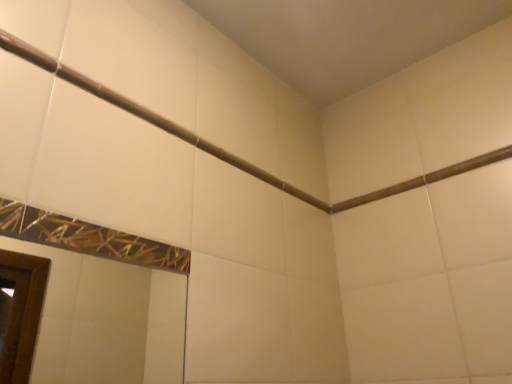
Question: Considering the relative positions of matte white shower at upper left and brown matte beam at upper center in the image provided, is matte white shower at upper left to the left or to the right of brown matte beam at upper center?

Choices:
 (A) right
 (B) left

Answer: (B)

Question: Considering the positions of matte white shower at upper left and brown matte beam at upper center in the image, is matte white shower at upper left bigger or smaller than brown matte beam at upper center?

Choices:
 (A) big
 (B) small

Answer: (A)

Question: From a real-world perspective, is matte white shower at upper left above or below brown matte beam at upper center?

Choices:
 (A) below
 (B) above

Answer: (A)

Question: From the image's perspective, is brown matte beam at upper center positioned above or below matte white shower at upper left?

Choices:
 (A) below
 (B) above

Answer: (A)

Question: In the image, is brown matte beam at upper center positioned in front of or behind matte white shower at upper left?

Choices:
 (A) behind
 (B) front

Answer: (A)

Question: Considering the positions of point (404, 185) and point (98, 97), is point (404, 185) closer or farther from the camera than point (98, 97)?

Choices:
 (A) closer
 (B) farther

Answer: (B)

Question: From a real-world perspective, is brown matte beam at upper center above or below matte white shower at upper left?

Choices:
 (A) above
 (B) below

Answer: (A)